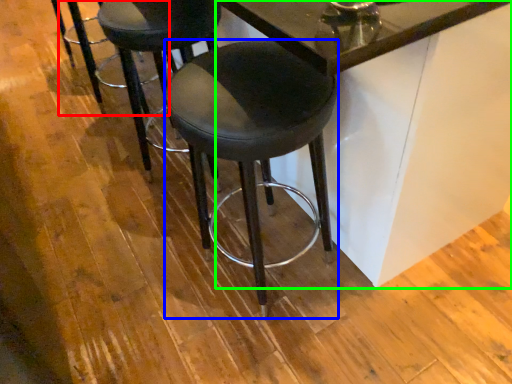
Question: Which object is positioned farthest from bar stool (highlighted by a red box)? Select from stool (highlighted by a blue box) and table (highlighted by a green box).

Choices:
 (A) stool
 (B) table

Answer: (B)